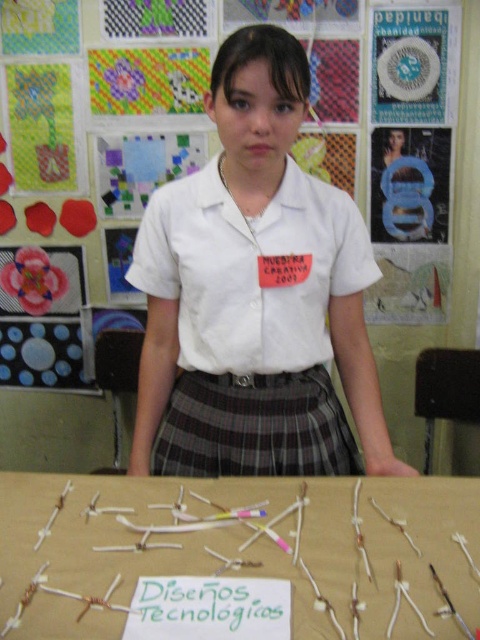
You are organizing a clothing display and need to arrange the white cotton shirt at center and the plaid fabric skirt at center on a mannequin. Which item should you place first to ensure proper layering?

The white cotton shirt at center should be placed first because it is larger in size than the plaid fabric skirt at center, allowing the skirt to be layered over or under appropriately.

You are organizing a clothing display and need to place the white cotton shirt at center and the plaid fabric skirt at center side by side on a shelf. If the shelf has a width of 1 meter, will both items fit without overlapping?

The white cotton shirt at center is wider than the plaid fabric skirt at center. However, since the total width of both items combined is not specified, it is uncertain if they will fit on a 1 meter shelf without overlapping.

You are an event organizer at the MUESTRA CREATIVA 2007 and need to determine if the white plastic sticks at center can be placed vertically on the table without touching the white plaid skirt at center. Based on their heights, can this be done?

The white plaid skirt at center is taller than the white plastic sticks at center. Therefore, the white plastic sticks at center are shorter than the skirt. If placed vertically, the sticks would not reach the height of the skirt, so they can be placed without touching it.